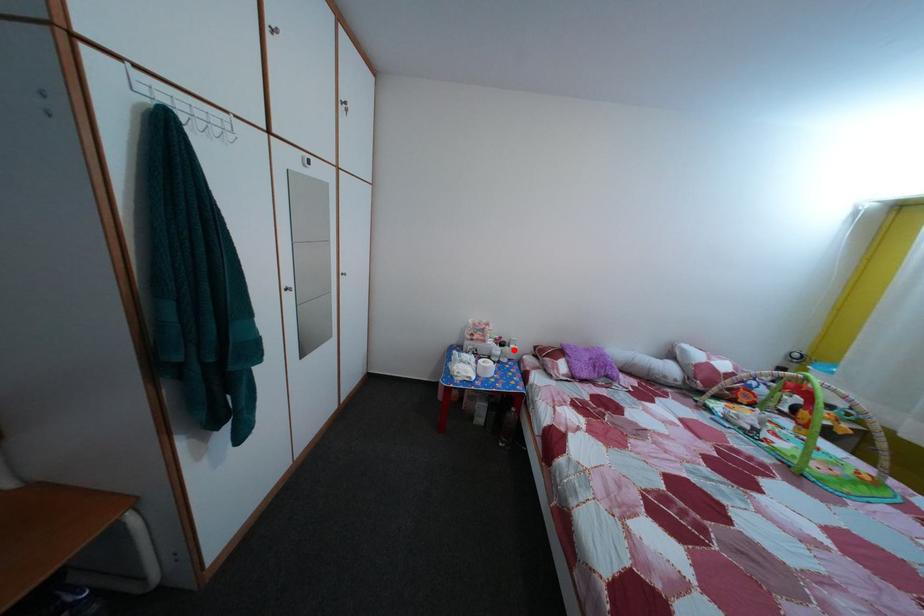
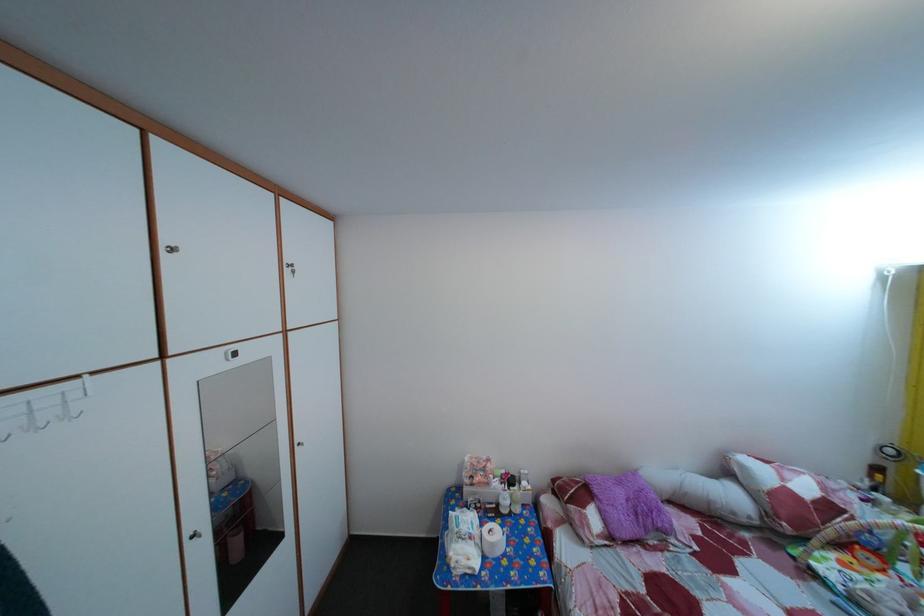
In the second image, find the point that corresponds to the highlighted location in the first image.

(524, 485)